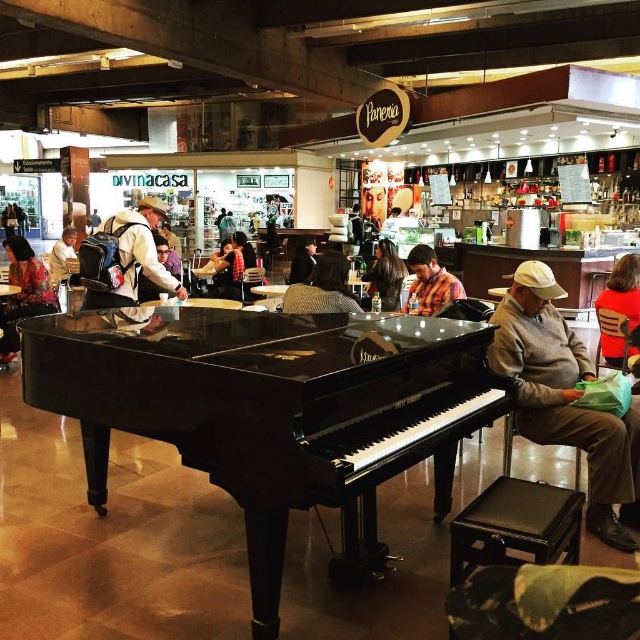
Looking at this image, you are a photographer trying to capture a candid shot of the man at the piano. You notice the dark brown hair at center and the light brown leather jacket at left. Which object is positioned lower in the frame?

The dark brown hair at center is positioned lower in the frame than the light brown leather jacket at left.